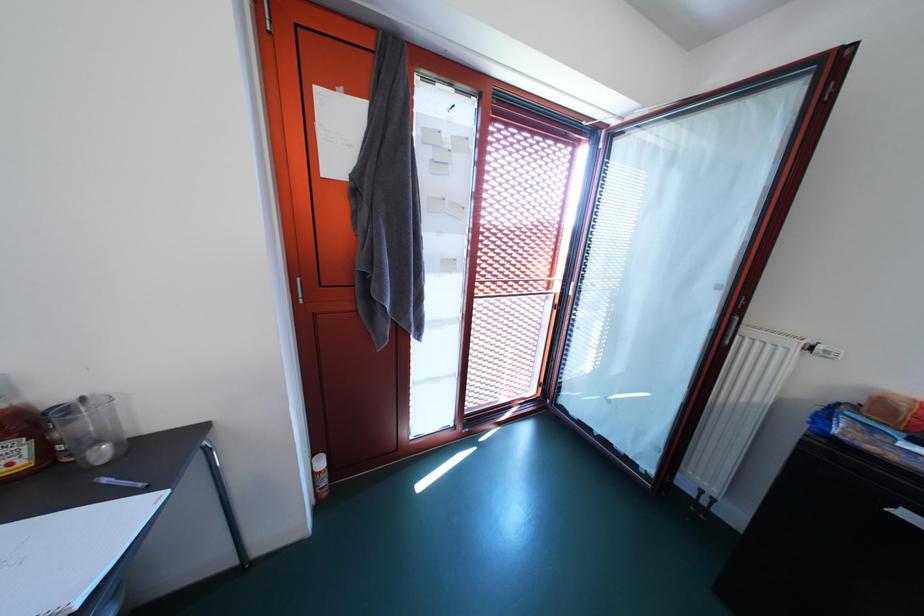
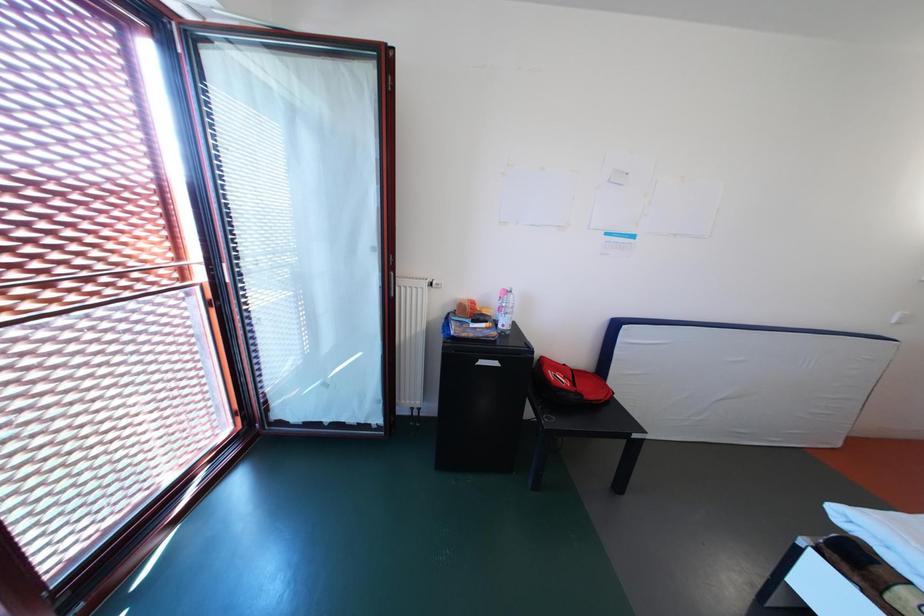
Question: The camera is either moving clockwise (left) or counter-clockwise (right) around the object. The first image is from the beginning of the video and the second image is from the end. Is the camera moving left or right when shooting the video?

Choices:
 (A) Left
 (B) Right

Answer: (A)